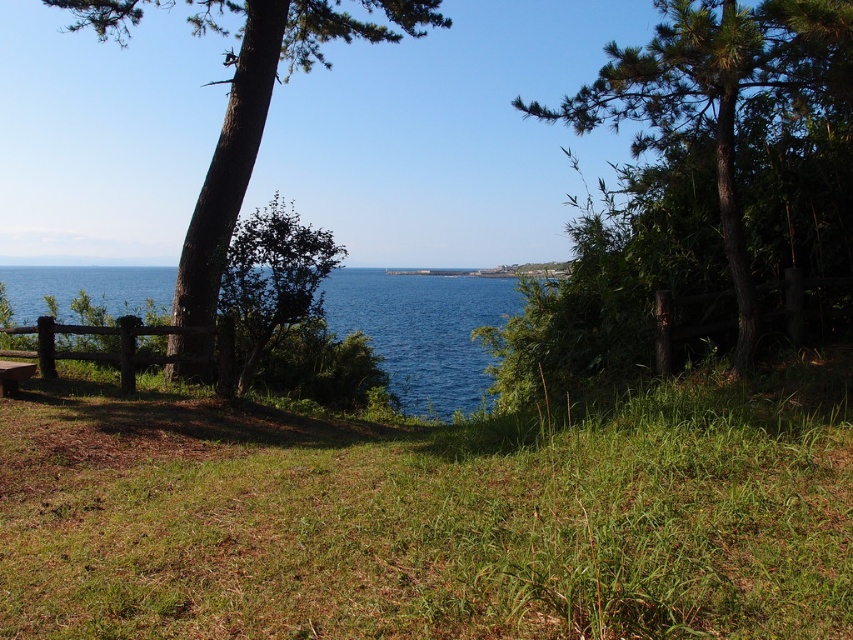
You are standing at the center of the grassy area in the scene. Which direction should you walk to reach the green textured tree at left?

You should walk to the left to reach the green textured tree at left since it is located at the left side of the scene.